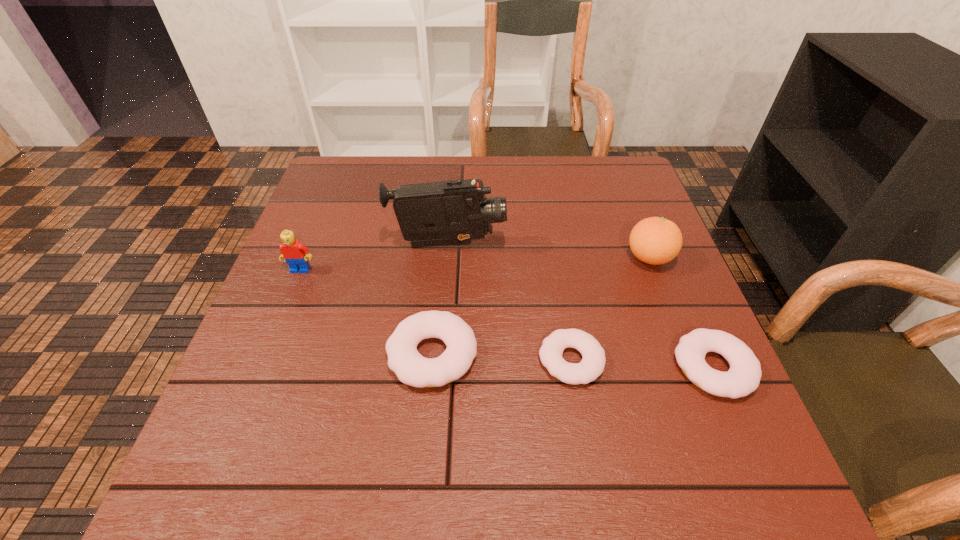
All doughnuts are currently evenly spaced. To continue this pattern, where would you add another doughnut on the left? Please point out a vacant spot. Please provide its 2D coordinates. Your answer should be formatted as a tuple, i.e. [(x, y)], where the tuple contains the x and y coordinates of a point satisfying the conditions above.

[(297, 348)]